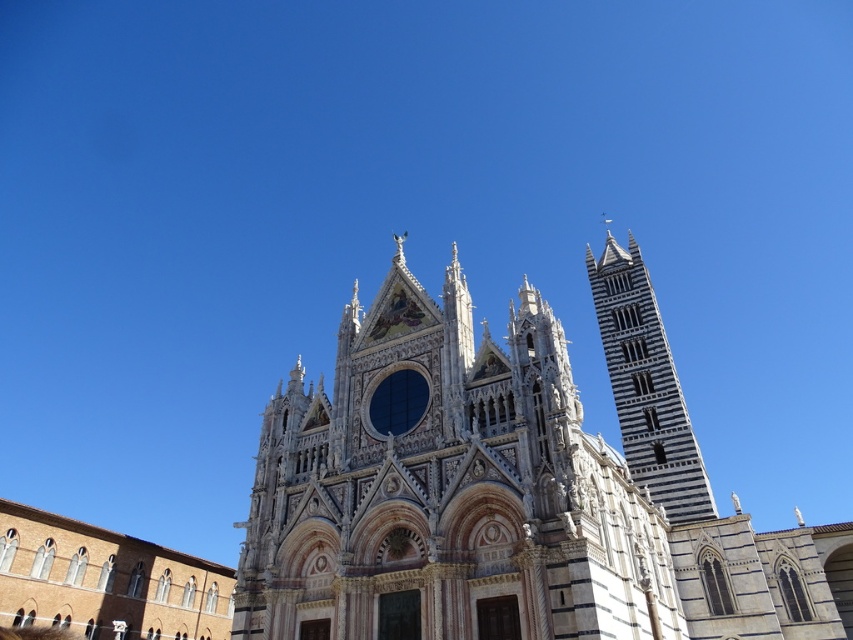
Question: Which object appears farthest from the camera in this image?

Choices:
 (A) white stone church at center
 (B) white marble tower at right

Answer: (B)

Question: Can you confirm if white stone church at center is positioned above white marble tower at right?

Choices:
 (A) no
 (B) yes

Answer: (A)

Question: Can you confirm if white stone church at center is positioned below white marble tower at right?

Choices:
 (A) no
 (B) yes

Answer: (B)

Question: Can you confirm if white stone church at center is thinner than white marble tower at right?

Choices:
 (A) no
 (B) yes

Answer: (A)

Question: Which point appears farthest from the camera in this image?

Choices:
 (A) (10, 536)
 (B) (631, 291)

Answer: (B)